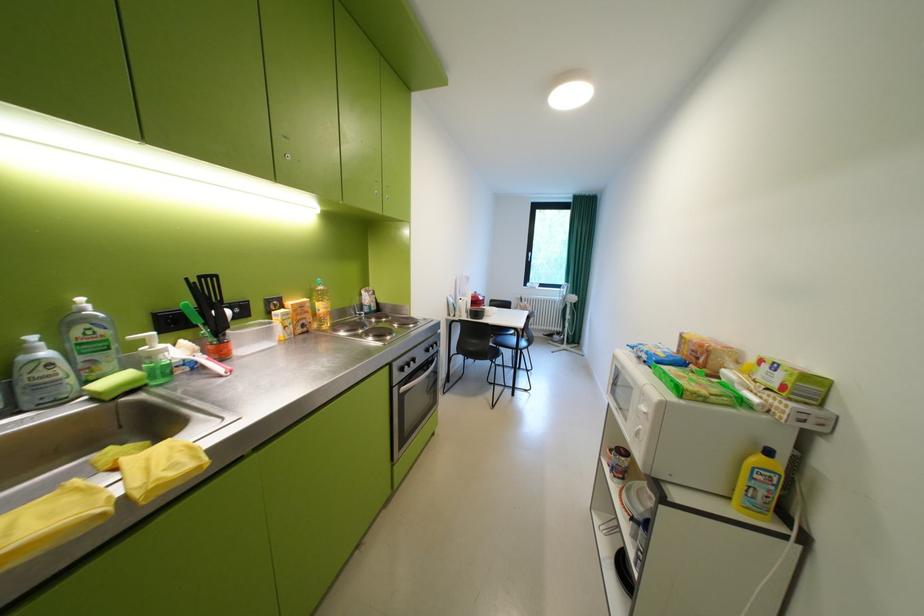
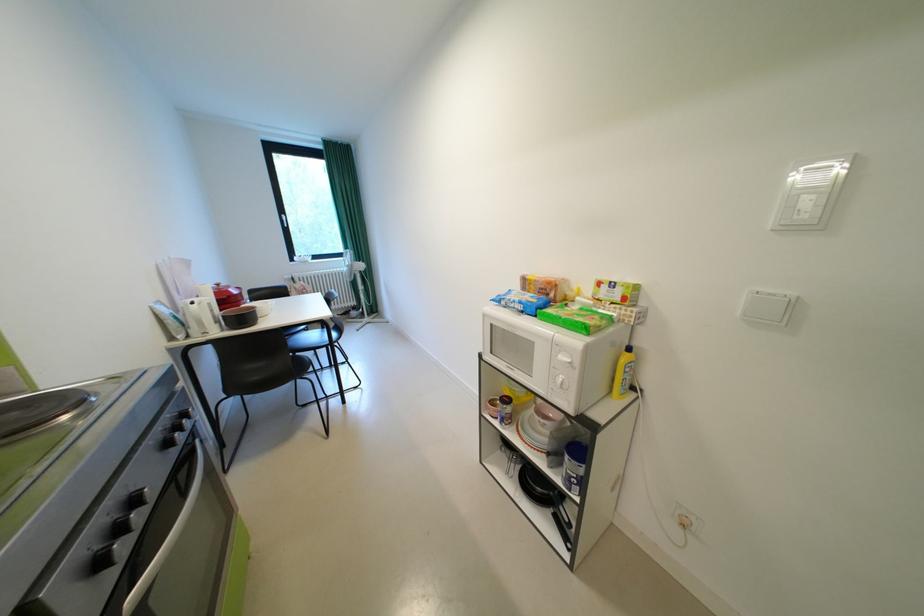
Locate, in the second image, the point that corresponds to [524,341] in the first image.

(325, 337)